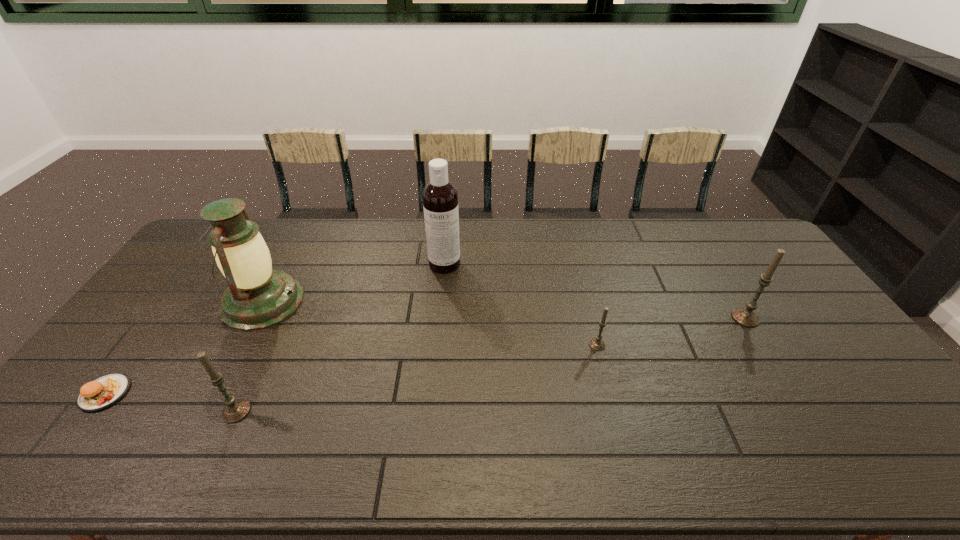
Locate an element on the screen. the shortest object is located at coordinates (103, 392).

You are a GUI agent. You are given a task and a screenshot of the screen. Output one action in this format:
    pyautogui.click(x=<x>, y=<y>)
    Task: Click on the vacant space located 0.060m on the left of the nearest candle
    
    Given the screenshot: What is the action you would take?
    pyautogui.click(x=199, y=411)

Identify the location of blank area located on the right of the third nearest object. The width and height of the screenshot is (960, 540). (707, 345).

In order to click on free location located on the right of the rightmost object in this screenshot , I will do `click(788, 318)`.

Identify the location of free spot located 0.380m on the label side of the dishwasher detergent. This screenshot has height=540, width=960. (435, 364).

Where is `free space located 0.190m with the light compartment facing forward on the lantern`? The width and height of the screenshot is (960, 540). free space located 0.190m with the light compartment facing forward on the lantern is located at coordinates (363, 302).

This screenshot has height=540, width=960. Identify the location of vacant space situated 0.350m on the back of the patty. (184, 287).

This screenshot has height=540, width=960. Find the location of `object that is at the far edge`. object that is at the far edge is located at coordinates (440, 198).

Identify the location of candle that is at the near edge. The height and width of the screenshot is (540, 960). (235, 410).

Find the location of a particular element. The image size is (960, 540). patty at the near edge is located at coordinates (103, 392).